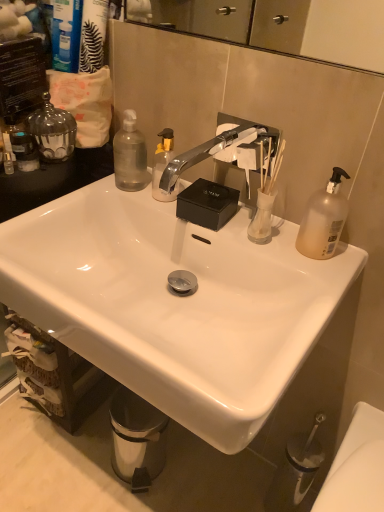
Question: From the image's perspective, is translucent plastic pump bottle at right, which is counted as the first bottle, starting from the front, above or below stainless steel trash can at lower left?

Choices:
 (A) below
 (B) above

Answer: (B)

Question: Considering the positions of translucent plastic pump bottle at right, the 2th bottle in the left-to-right sequence, and stainless steel trash can at lower left in the image, is translucent plastic pump bottle at right, the 2th bottle in the left-to-right sequence, taller or shorter than stainless steel trash can at lower left?

Choices:
 (A) tall
 (B) short

Answer: (B)

Question: Which object is the farthest from the translucent plastic soap dispenser at left, the second toiletry in the right-to-left sequence?

Choices:
 (A) translucent plastic pump bottle at right, which is the first bottle in right-to-left order
 (B) transparent plastic bottle at upper left, which is the 2th bottle from front to back
 (C) white glossy sink at center
 (D) chrome metallic faucet at center
 (E) stainless steel trash can at lower left

Answer: (E)

Question: Estimate the real-world distances between objects in this image. Which object is closer to the translucent plastic pump bottle at right, which is the first bottle in right-to-left order?

Choices:
 (A) chrome metallic faucet at center
 (B) white glossy sink at center
 (C) stainless steel trash can at lower left
 (D) transparent plastic bottle at upper left, the 2th bottle in the right-to-left sequence
 (E) translucent plastic soap dispenser at left, the first toiletry when ordered from left to right

Answer: (A)